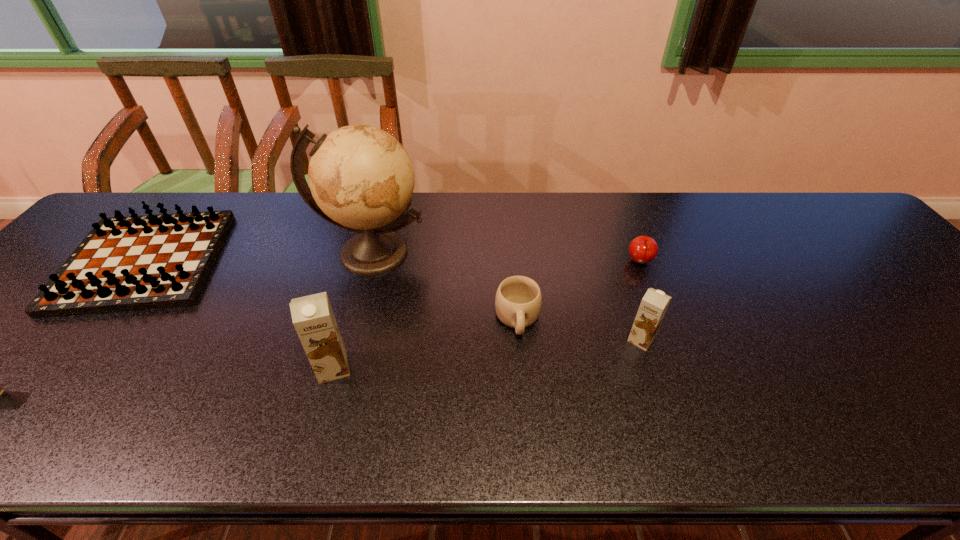
Choose which chocolate milk is the nearest neighbor to the globe. Please provide its 2D coordinates. Your answer should be formatted as a tuple, i.e. [(x, y)], where the tuple contains the x and y coordinates of a point satisfying the conditions above.

[(313, 318)]

Identify the location of vacant region that satisfies the following two spatial constraints: 1. on the back side of the taller chocolate milk; 2. on the left side of the cherry. This screenshot has width=960, height=540. (363, 262).

Where is `vacant space that satisfies the following two spatial constraints: 1. on the back side of the cherry; 2. on the left side of the nearest object`? vacant space that satisfies the following two spatial constraints: 1. on the back side of the cherry; 2. on the left side of the nearest object is located at coordinates (363, 262).

Find the location of a particular element. vacant space that satisfies the following two spatial constraints: 1. on the front-facing side of the tallest object; 2. on the left side of the cherry is located at coordinates (370, 262).